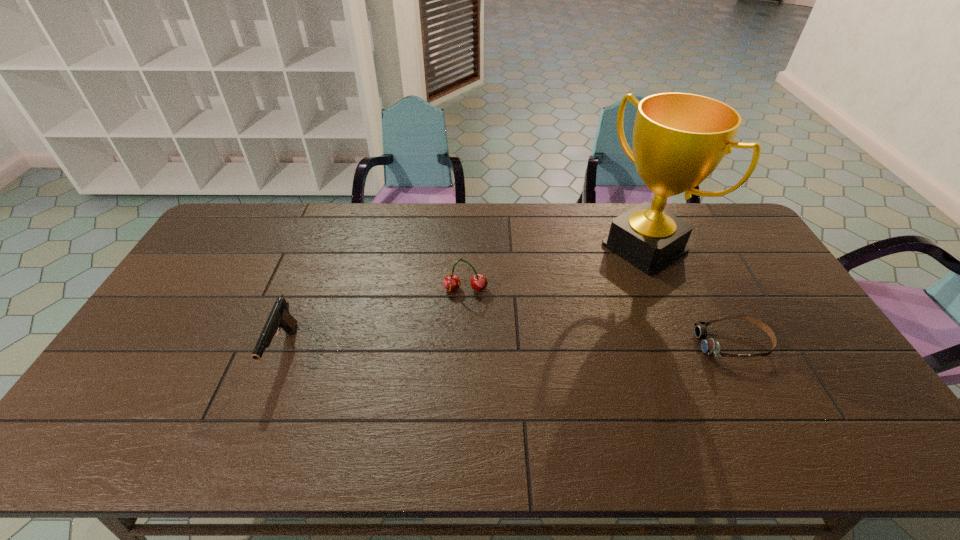
Identify the location of free location at the near right corner of the desktop. (818, 407).

Where is `free space between the pistol and the tallest object`? This screenshot has width=960, height=540. free space between the pistol and the tallest object is located at coordinates (464, 299).

This screenshot has height=540, width=960. What are the coordinates of `empty space between the cherry and the leftmost object` in the screenshot? It's located at (374, 320).

Where is `vacant space in between the third object from right to left and the tallest object`? vacant space in between the third object from right to left and the tallest object is located at coordinates (555, 268).

Locate an element on the screen. free space between the award and the leftmost object is located at coordinates (464, 299).

Locate an element on the screen. The image size is (960, 540). vacant region between the award and the goggles is located at coordinates (689, 295).

Locate an element on the screen. The height and width of the screenshot is (540, 960). vacant space in between the tallest object and the shortest object is located at coordinates (689, 295).

The image size is (960, 540). I want to click on free spot between the award and the pistol, so click(464, 299).

Identify the location of free space that is in between the award and the cherry. The height and width of the screenshot is (540, 960). (555, 268).

Image resolution: width=960 pixels, height=540 pixels. I want to click on free space between the award and the shortest object, so click(689, 295).